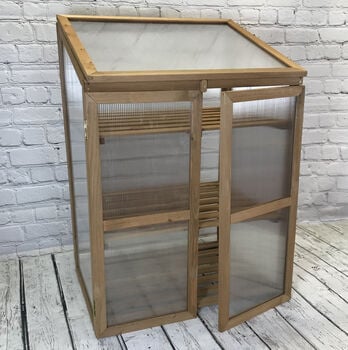
Locate an element on the screen. The height and width of the screenshot is (350, 348). door clasp is located at coordinates (203, 85).